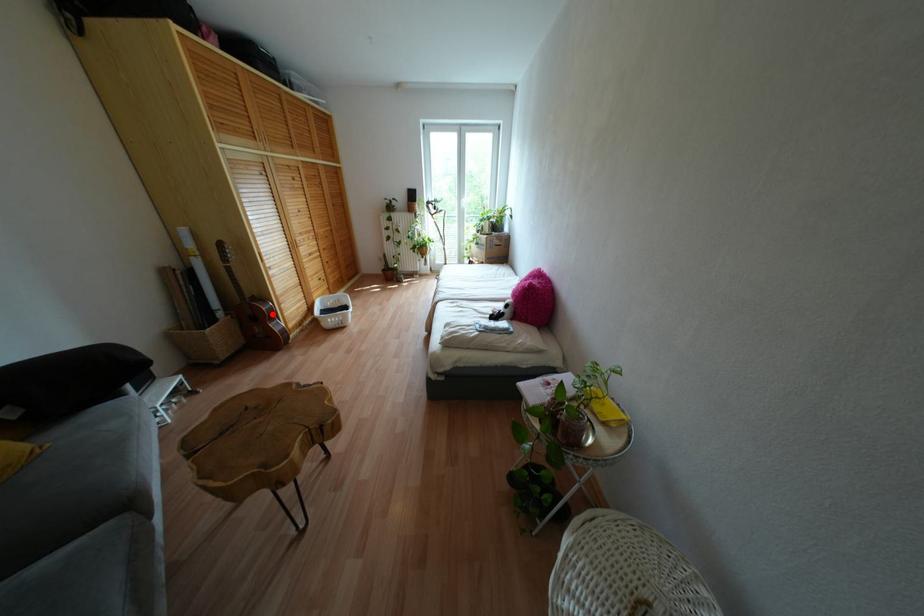
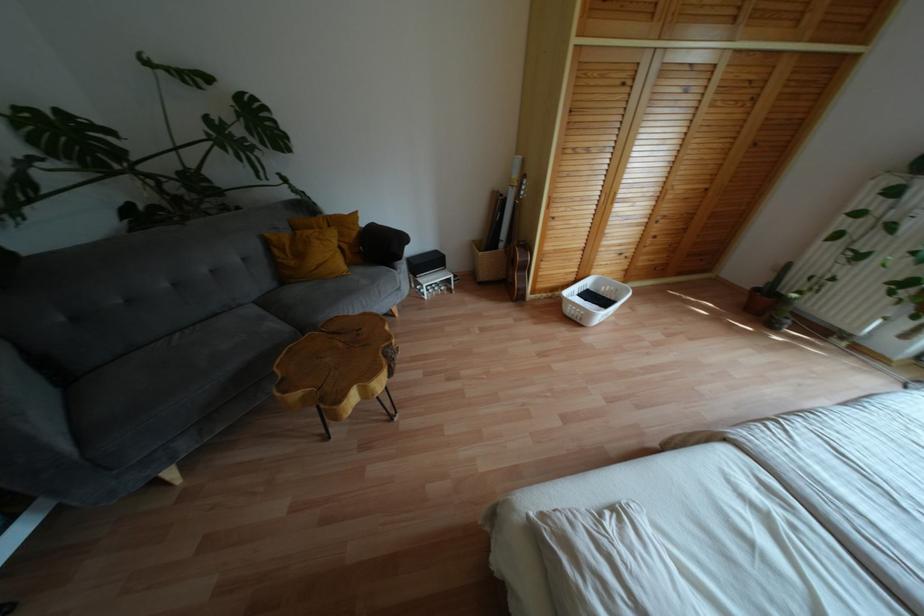
Question: I am providing you with two images of the same scene from different viewpoints. In image1, a red point is highlighted. Considering the same 3D point in image2, which of the following is correct?

Choices:
 (A) It is closer
 (B) It is farther

Answer: (B)